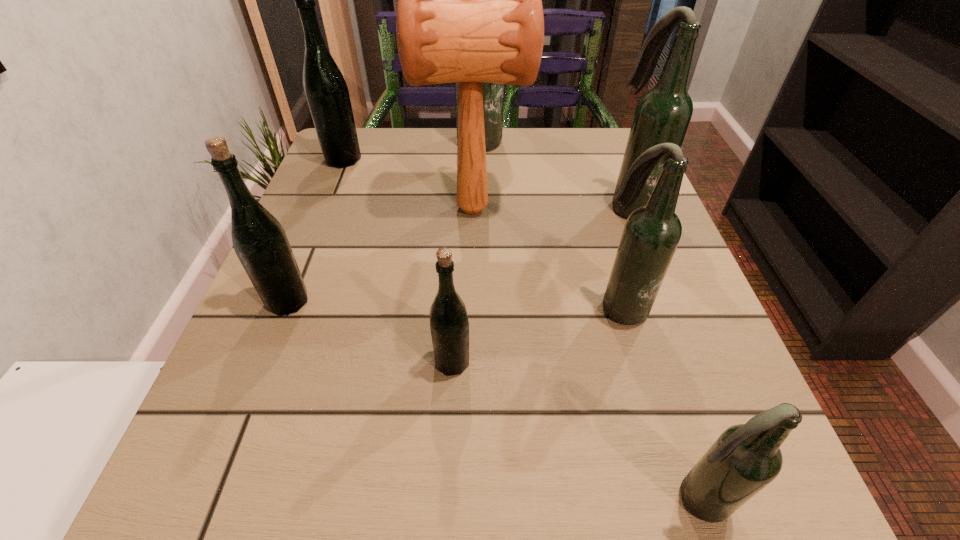
I want to click on free spot between the farthest dark beer bottle and the second smallest green beer bottle, so coord(380,221).

In order to click on free space between the second biggest dark beer bottle and the mallet in this screenshot , I will do `click(552, 207)`.

At what (x,y) coordinates should I click in order to perform the action: click on free space between the farthest green beer bottle and the smallest dark beer bottle. Please return your answer as a coordinate pair (x, y). Image resolution: width=960 pixels, height=540 pixels. Looking at the image, I should click on (519, 329).

Where is `free space between the farthest green beer bottle and the nearest beer bottle`? Image resolution: width=960 pixels, height=540 pixels. free space between the farthest green beer bottle and the nearest beer bottle is located at coordinates (519, 329).

At what (x,y) coordinates should I click in order to perform the action: click on vacant point located between the nearest object and the farthest dark beer bottle. Please return your answer as a coordinate pair (x, y). This screenshot has height=540, width=960. Looking at the image, I should click on (584, 320).

The height and width of the screenshot is (540, 960). Find the location of `vacant area that lies between the fifth nearest beer bottle and the leftmost dark beer bottle`. vacant area that lies between the fifth nearest beer bottle and the leftmost dark beer bottle is located at coordinates (551, 174).

Locate an element on the screen. Image resolution: width=960 pixels, height=540 pixels. unoccupied area between the mallet and the nearest green beer bottle is located at coordinates click(x=463, y=286).

Where is `free space between the second smallest dark beer bottle and the leftmost dark beer bottle`? This screenshot has width=960, height=540. free space between the second smallest dark beer bottle and the leftmost dark beer bottle is located at coordinates (546, 224).

At what (x,y) coordinates should I click in order to perform the action: click on vacant space that's between the mallet and the nearest beer bottle. Please return your answer as a coordinate pair (x, y). Looking at the image, I should click on (584, 354).

The image size is (960, 540). Find the location of `unoccupied position between the biggest green beer bottle and the biggest dark beer bottle`. unoccupied position between the biggest green beer bottle and the biggest dark beer bottle is located at coordinates (408, 151).